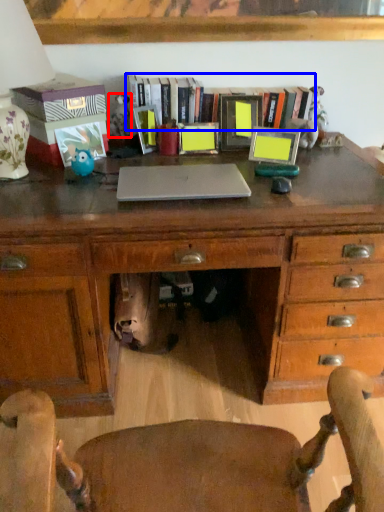
Question: Which point is further to the camera, toy (highlighted by a red box) or book (highlighted by a blue box)?

Choices:
 (A) toy
 (B) book

Answer: (A)